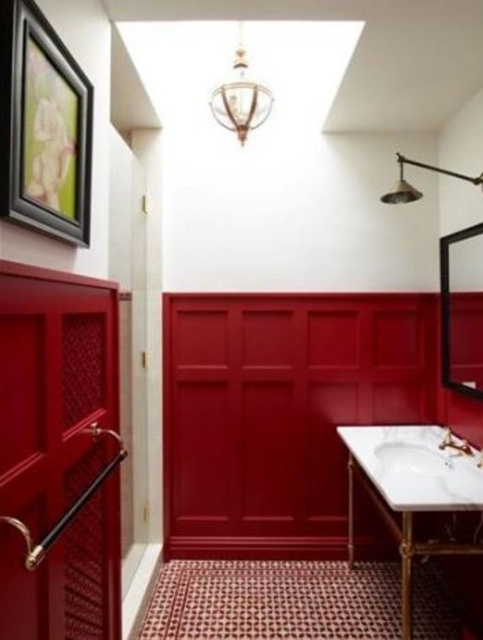
You are standing in the bathroom and notice two points marked on the wall. The first point is at coordinates point (385, 458) and the second is at point (467, 452). Which point is closer to you?

Point (385, 458) is closer to you because it is further to the viewer than point (467, 452).

You are standing in the bathroom and want to wash your hands. The sink is the white marble sink at lower right. Based on its 2D coordinates, where should you look to find it?

The white marble sink at lower right is located at the 2D coordinates point (x=414, y=467), so you should look towards the lower right area of the bathroom to find it.

You are a plumber trying to install a new faucet. The current matte gold faucet at lower center is too close to the white marble sink at lower right. According to plumbing codes, the minimum distance between the faucet and the sink should be 10 inches. Is the current distance compliant with the code?

The white marble sink at lower right is 9.14 inches from the matte gold faucet at lower center. Since 9.14 inches is less than the required 10 inches, the current distance does not comply with the plumbing code.